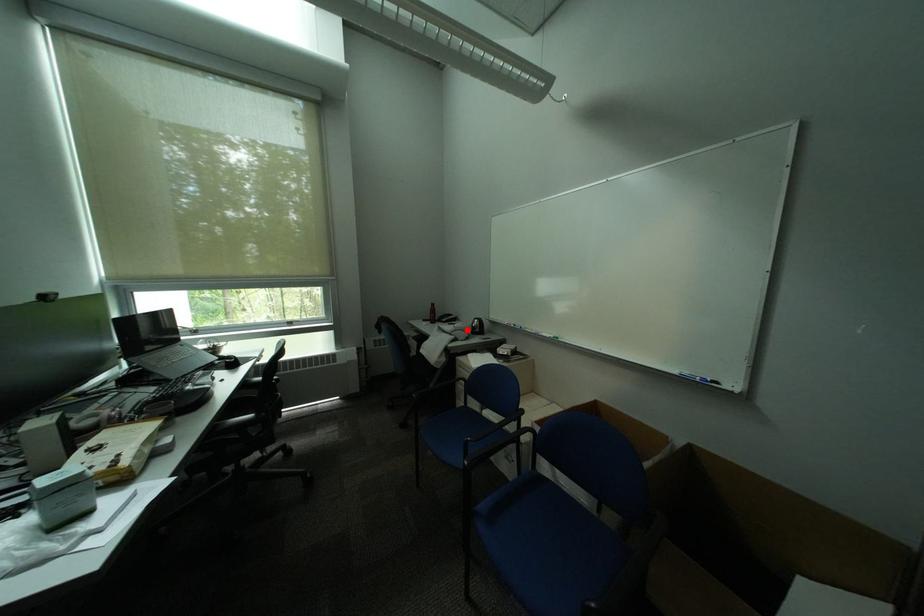
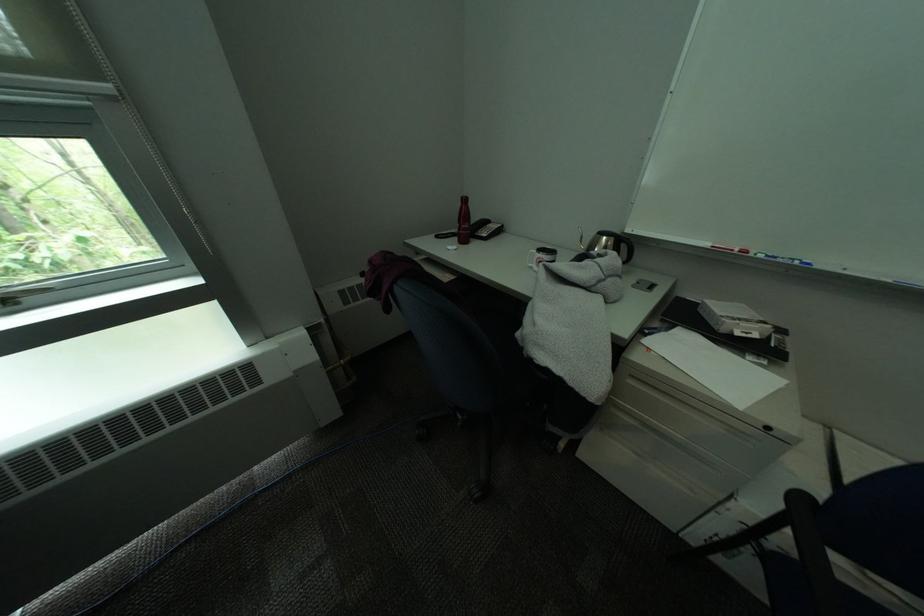
Where in the second image is the point corresponding to the highlighted location from the first image?

(615, 274)